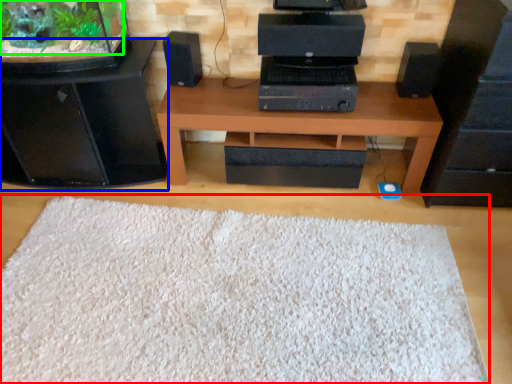
Question: Which object is the closest to the mat (highlighted by a red box)? Choose among these: furniture (highlighted by a blue box) or plant (highlighted by a green box).

Choices:
 (A) furniture
 (B) plant

Answer: (A)